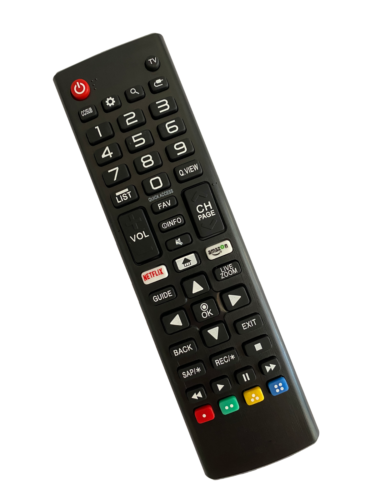
Locate an element on the screen. colored buttons on remote is located at coordinates (80, 92), (205, 419), (229, 406), (252, 395), (279, 389).